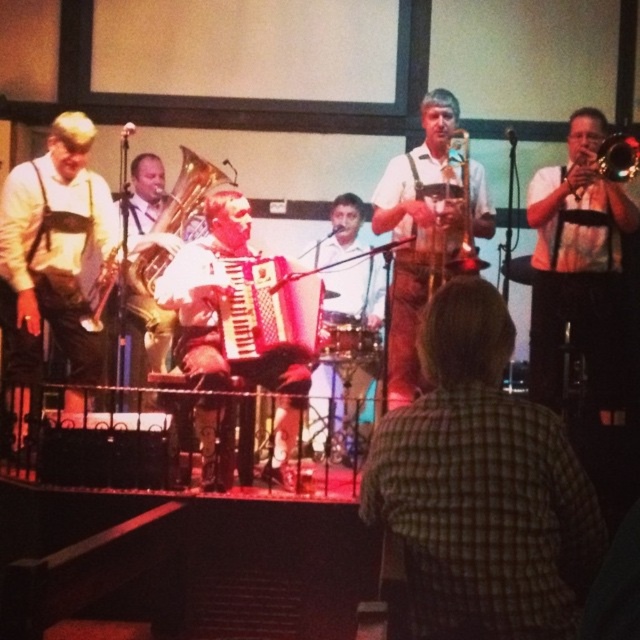
You are a stagehand who needs to adjust the microphone stand between the green plaid shirt at center and the wooden saxophone at center. The stand requires at least 5 feet of space between them to fit properly. Based on the scene, can you safely place the microphone stand between these two objects?

The green plaid shirt at center and wooden saxophone at center are 6.23 feet apart, which is more than the required 5 feet. Therefore, the microphone stand can be safely placed between them.